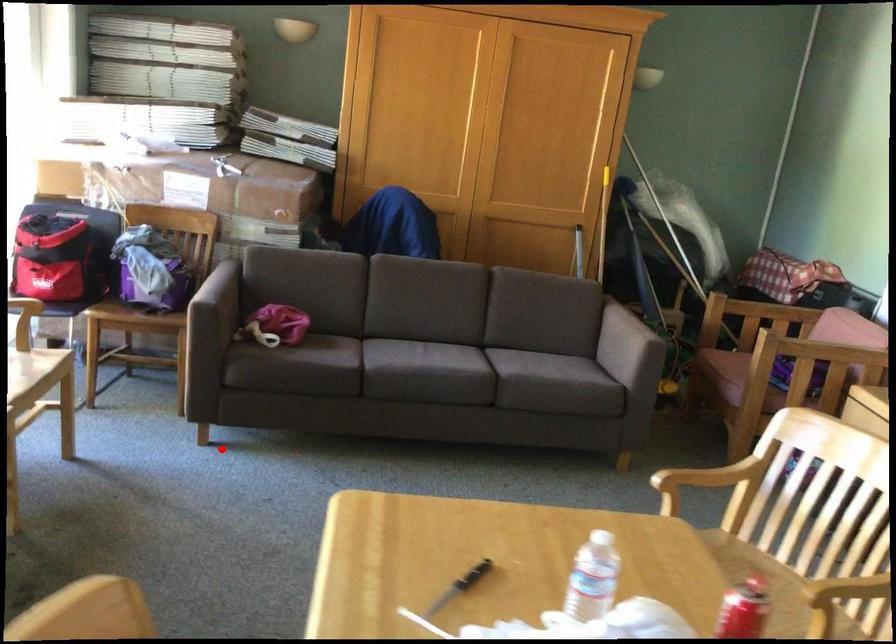
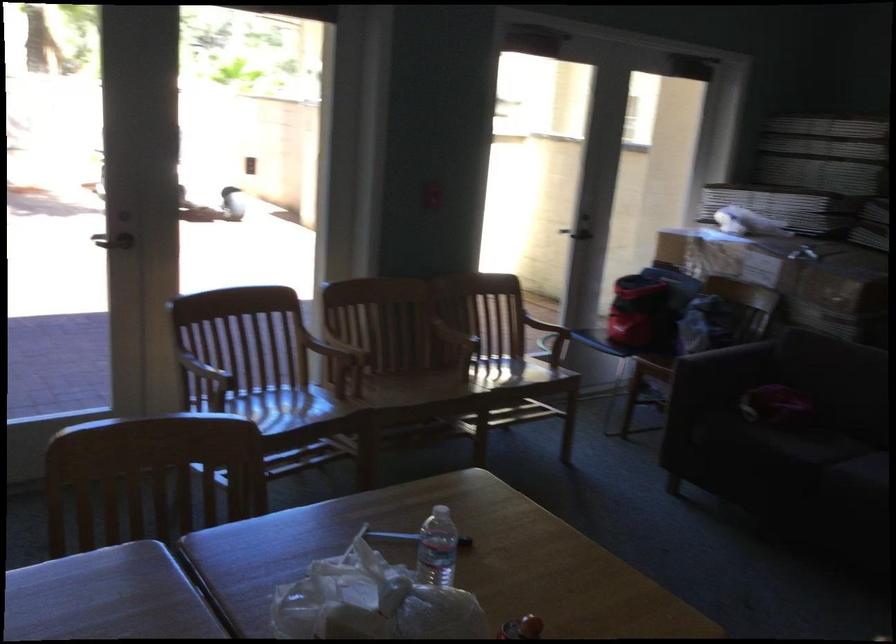
In the second image, find the point that corresponds to the highlighted location in the first image.

(673, 488)